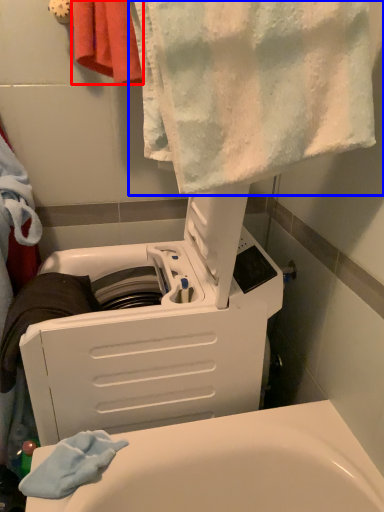
Question: Which point is closer to the camera, towel (highlighted by a red box) or towel (highlighted by a blue box)?

Choices:
 (A) towel
 (B) towel

Answer: (B)